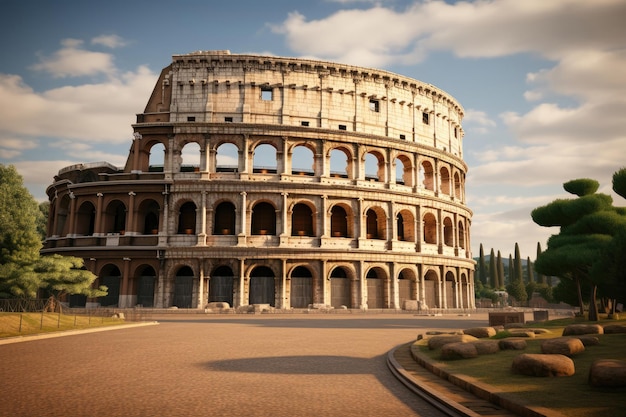
Locate an element on the screen. The height and width of the screenshot is (417, 626). statue is located at coordinates (503, 296).